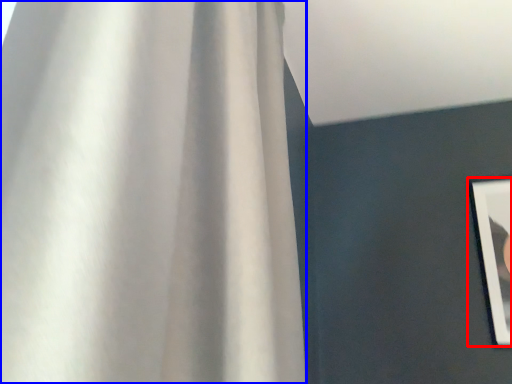
Question: Which object is closer to the camera taking this photo, picture frame (highlighted by a red box) or curtain (highlighted by a blue box)?

Choices:
 (A) picture frame
 (B) curtain

Answer: (B)